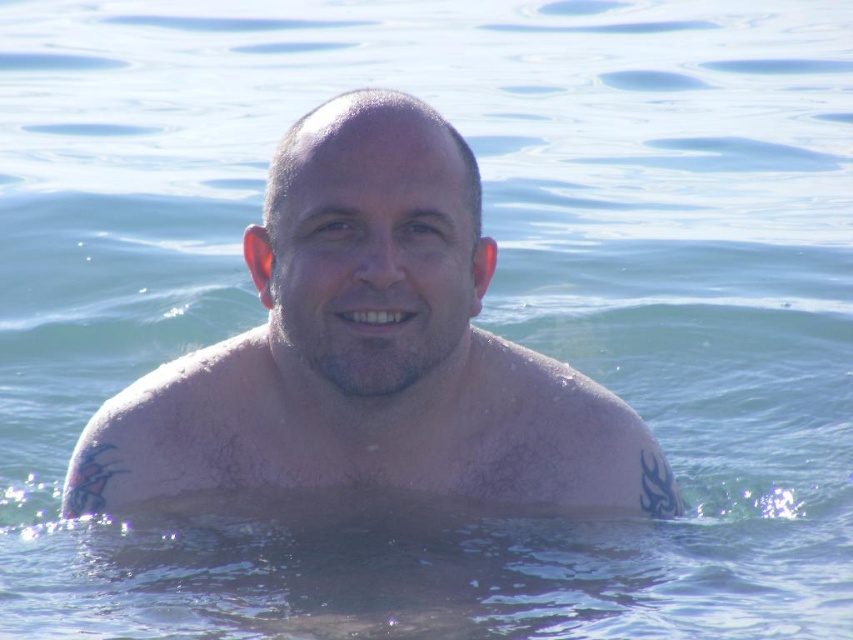
In the scene shown: Based on the scene description and the coordinates provided, what is the color of the area at point (369,353)?

The area at point (369,353) has pale skin color as indicated by the coordinates.

Based on the scene description, can you determine which part of the person is closer to the surface of the water, the pale skin at center or the pale skin muscle at center?

The pale skin at center is positioned over the pale skin muscle at center, meaning the pale skin at center is closer to the surface of the water.

You are a photographer taking a portrait of the person in the water. You notice two areas of focus on the person at the center. The first is the pale skin at center, and the second is the pale skin muscle at center. Which area is wider?

The pale skin at center is wider than the pale skin muscle at center.